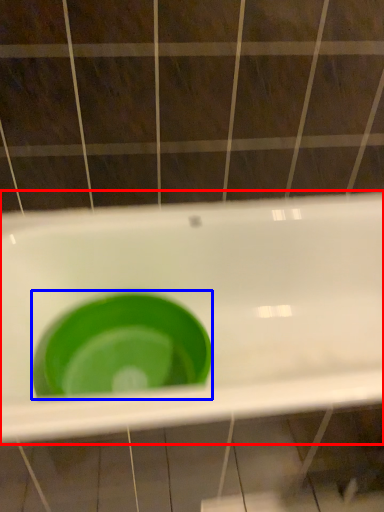
Question: Which object is further to the camera taking this photo, sink (highlighted by a red box) or basin (highlighted by a blue box)?

Choices:
 (A) sink
 (B) basin

Answer: (B)